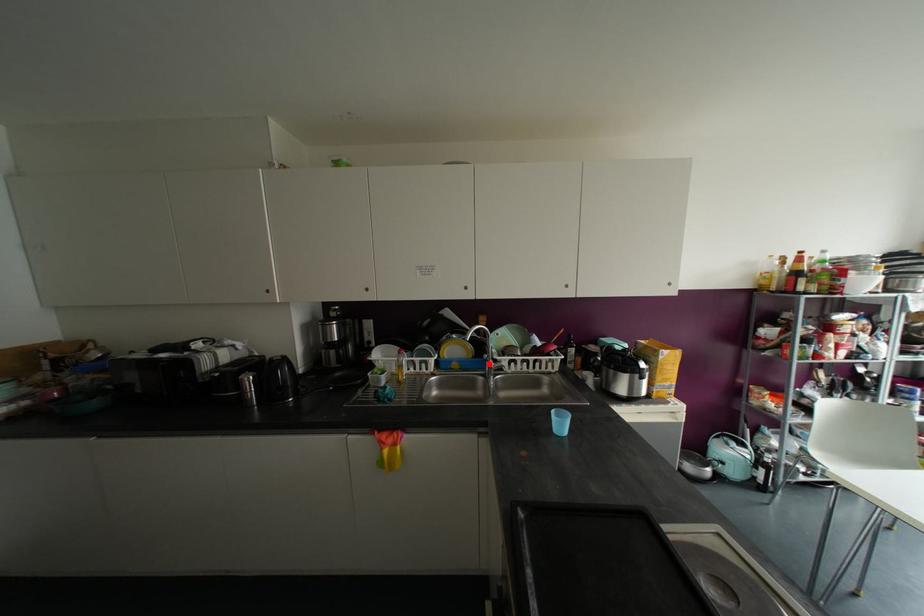
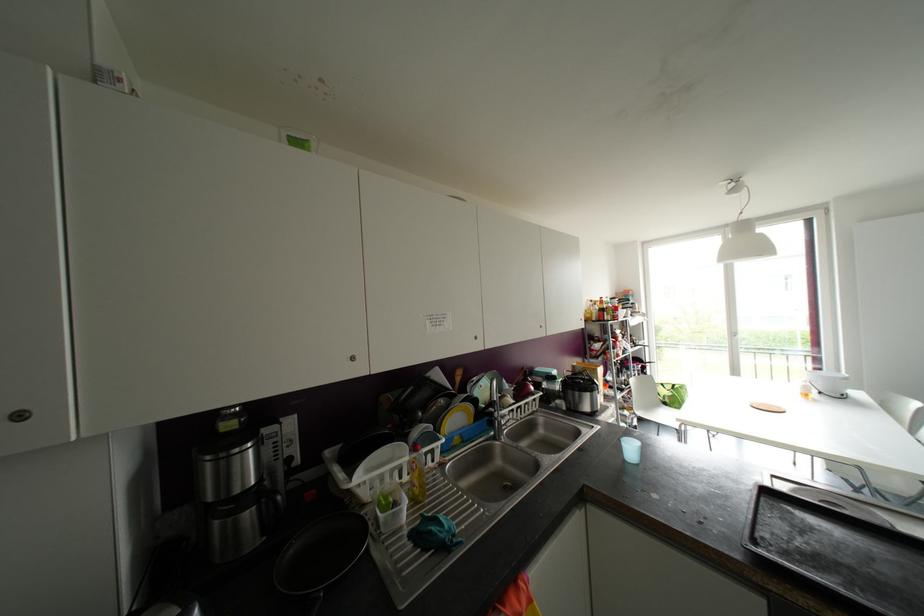
Find the pixel in the second image that matches the highlighted location in the first image.

(499, 422)